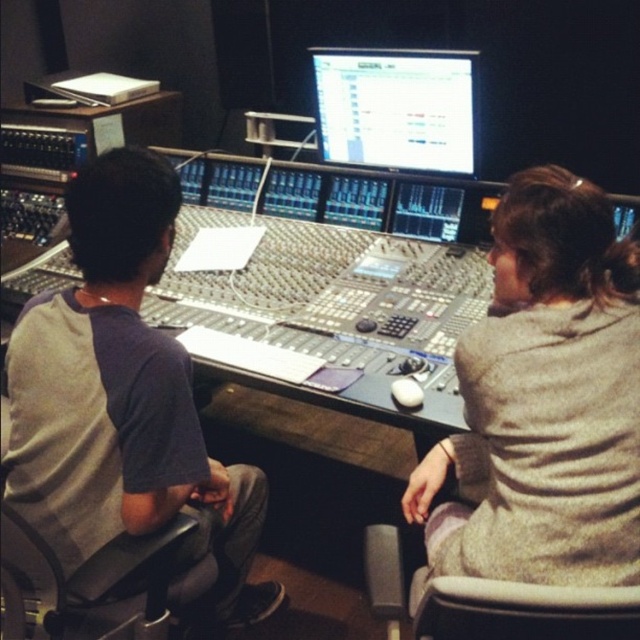
Which is below, gray wool sweater at right or matte black monitor at center?

gray wool sweater at right

From the picture: Who is positioned more to the right, gray wool sweater at right or matte black monitor at center?

From the viewer's perspective, gray wool sweater at right appears more on the right side.

Measure the distance between point (524, 348) and camera.

Point (524, 348) is 1.13 meters from camera.

Locate an element on the screen. The width and height of the screenshot is (640, 640). gray wool sweater at right is located at coordinates (545, 401).

Which is above, gray wool sweater at right or gray cotton shirt at left?

Positioned higher is gray wool sweater at right.

Is gray wool sweater at right smaller than gray cotton shirt at left?

Indeed, gray wool sweater at right has a smaller size compared to gray cotton shirt at left.

Does point (493, 342) come in front of point (116, 348)?

No, it is not.

Image resolution: width=640 pixels, height=640 pixels. What are the coordinates of `gray wool sweater at right` in the screenshot? It's located at (545, 401).

Is gray cotton shirt at left smaller than matte black monitor at center?

No.

Between point (115, 438) and point (432, 134), which one is positioned in front?

Point (115, 438)

I want to click on gray cotton shirt at left, so click(122, 397).

Locate an element on the screen. The image size is (640, 640). gray cotton shirt at left is located at coordinates (122, 397).